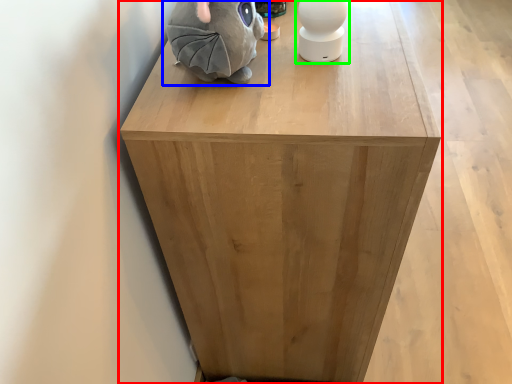
Question: Based on their relative distances, which object is farther from furniture (highlighted by a red box)? Choose from toy (highlighted by a blue box) and toy (highlighted by a green box).

Choices:
 (A) toy
 (B) toy

Answer: (B)